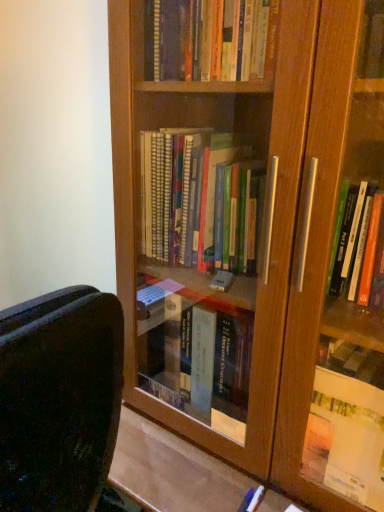
What do you see at coordinates (255, 233) in the screenshot? I see `wooden bookcase at center` at bounding box center [255, 233].

You are a GUI agent. You are given a task and a screenshot of the screen. Output one action in this format:
    pyautogui.click(x=<x>, y=<y>)
    Task: Click on the wooden bookcase at center
    Image resolution: width=384 pixels, height=512 pixels.
    Given the screenshot: What is the action you would take?
    pyautogui.click(x=255, y=233)

Measure the distance between wooden bookcase at center and camera.

A distance of 23.17 inches exists between wooden bookcase at center and camera.

Where is `wooden bookcase at center`? The height and width of the screenshot is (512, 384). wooden bookcase at center is located at coordinates (255, 233).